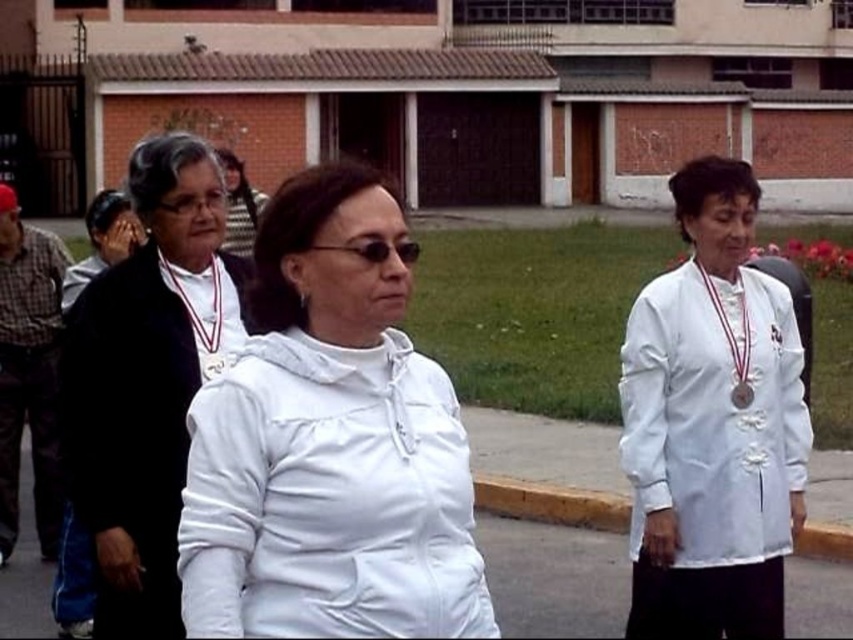
Question: Which point is farther to the camera?

Choices:
 (A) (218, 362)
 (B) (155, 388)
 (C) (608, 500)
 (D) (227, 237)

Answer: (D)

Question: Which object appears farthest from the camera in this image?

Choices:
 (A) matte black jacket at upper center
 (B) matte black jacket at center
 (C) silver metallic medal at center

Answer: (A)

Question: Can you confirm if yellow concrete curb at lower right is thinner than matte black jacket at upper center?

Choices:
 (A) yes
 (B) no

Answer: (A)

Question: Among these objects, which one is nearest to the camera?

Choices:
 (A) white matte lab coat at center
 (B) metallic silver medal at center-right

Answer: (A)

Question: In this image, where is matte black jacket at center located relative to silver metallic medal at center?

Choices:
 (A) below
 (B) above

Answer: (A)

Question: Is black plastic sunglasses at center in front of silver metallic medal at center?

Choices:
 (A) no
 (B) yes

Answer: (B)